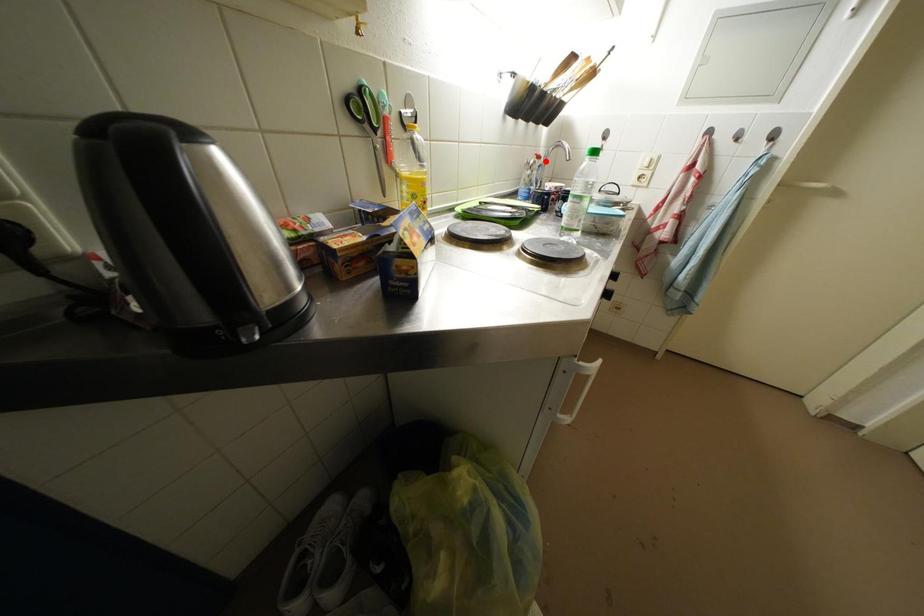
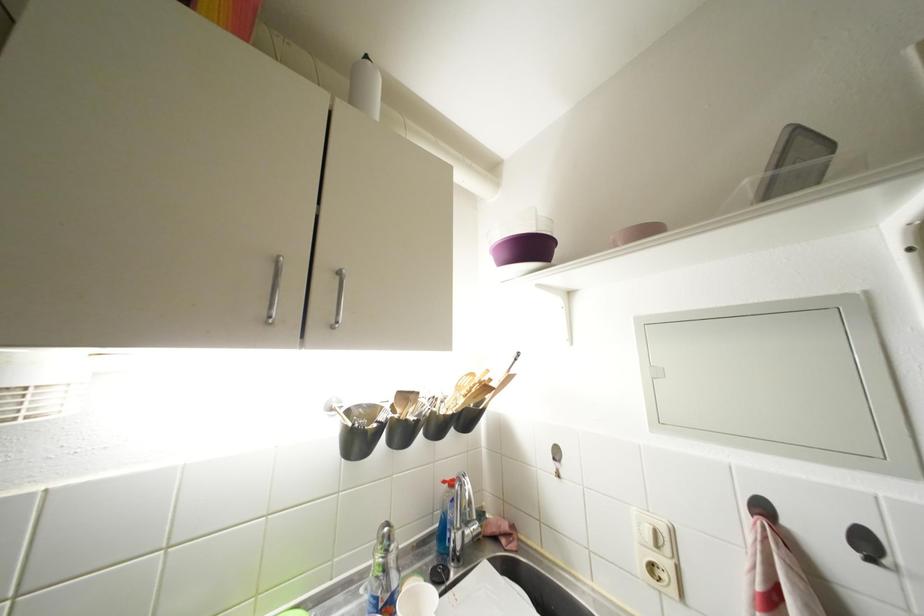
Question: I am providing you with two images of the same scene from different viewpoints. A red point is shown in image1. For the corresponding object point in image2, is it positioned nearer or farther from the camera?

Choices:
 (A) Nearer
 (B) Farther

Answer: (B)